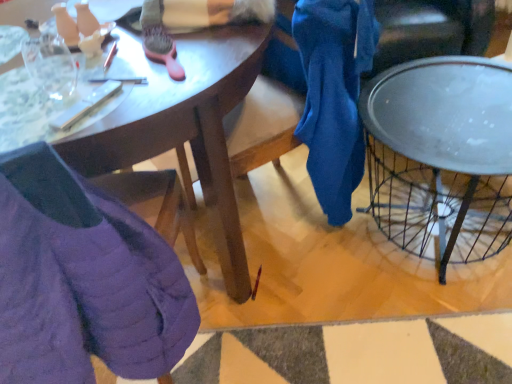
This screenshot has width=512, height=384. I want to click on vacant area situated below metallic silver tray at right (from a real-world perspective), so click(x=436, y=224).